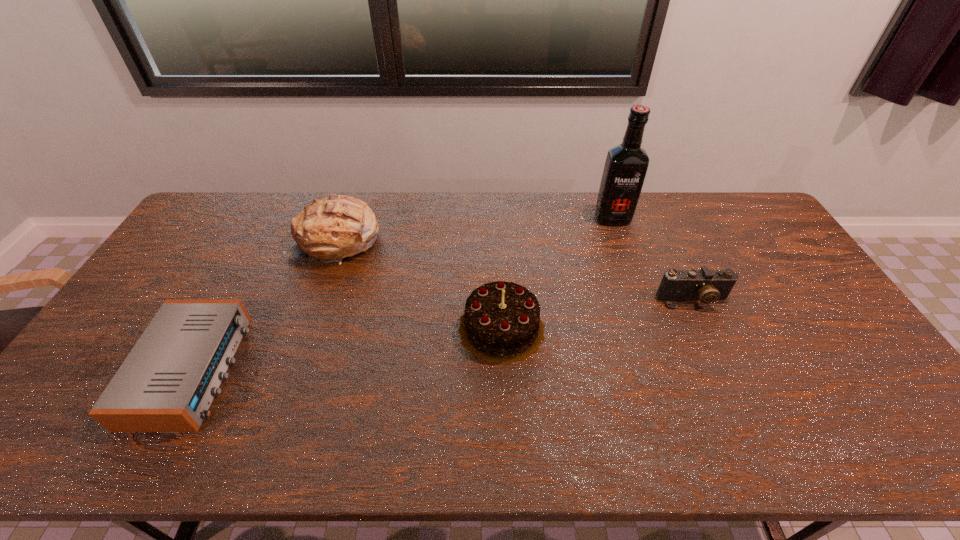
The width and height of the screenshot is (960, 540). In order to click on free space between the radio receiver and the third object from right to left in this screenshot , I will do `click(347, 349)`.

Where is `unoccupied area between the bread and the tallest object`? This screenshot has width=960, height=540. unoccupied area between the bread and the tallest object is located at coordinates (475, 229).

Locate an element on the screen. vacant area between the birthday cake and the tallest object is located at coordinates (557, 273).

Where is `vacant space in between the camera and the liquor`? vacant space in between the camera and the liquor is located at coordinates (653, 259).

This screenshot has width=960, height=540. Identify the location of free space between the birthday cake and the tallest object. (557, 273).

Where is `vacant space in between the camera and the liquor`? The height and width of the screenshot is (540, 960). vacant space in between the camera and the liquor is located at coordinates (653, 259).

The width and height of the screenshot is (960, 540). I want to click on free spot between the second shortest object and the third object from right to left, so click(597, 314).

Identify the location of free space between the radio receiver and the third object from right to left. The height and width of the screenshot is (540, 960). (347, 349).

At what (x,y) coordinates should I click in order to perform the action: click on unoccupied area between the bread and the camera. Please return your answer as a coordinate pair (x, y). Image resolution: width=960 pixels, height=540 pixels. Looking at the image, I should click on (516, 269).

Locate which object ranks third in proximity to the bread. Please provide its 2D coordinates. Your answer should be formatted as a tuple, i.e. [(x, y)], where the tuple contains the x and y coordinates of a point satisfying the conditions above.

[(626, 165)]